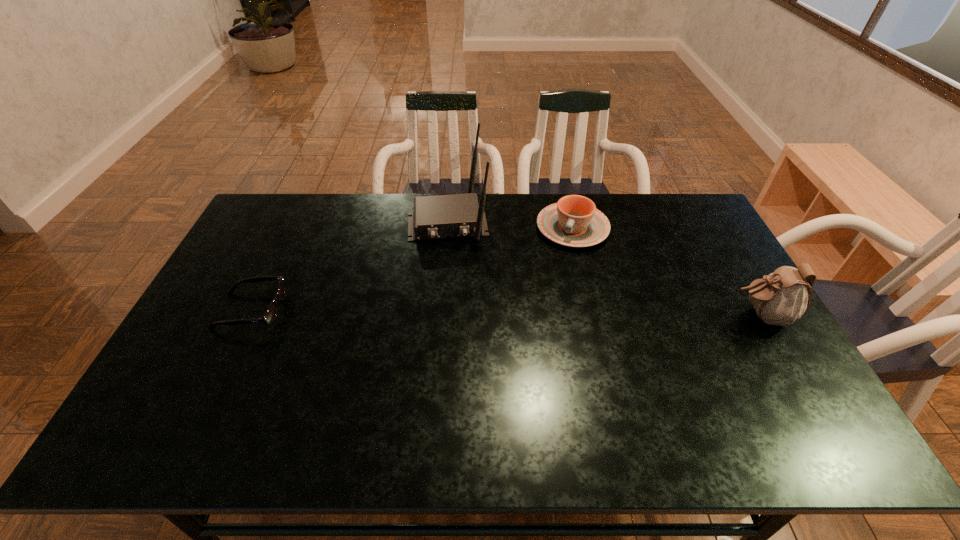
I want to click on object at the left edge, so click(269, 316).

At what (x,y) coordinates should I click in order to perform the action: click on object at the right edge. Please return your answer as a coordinate pair (x, y). The image size is (960, 540). Looking at the image, I should click on (780, 298).

You are a GUI agent. You are given a task and a screenshot of the screen. Output one action in this format:
    pyautogui.click(x=<x>, y=<y>)
    Task: Click on the free space at the far edge
    This screenshot has height=540, width=960.
    Given the screenshot: What is the action you would take?
    pyautogui.click(x=349, y=198)

In the image, there is a desktop. Identify the location of vacant space at the near edge. The width and height of the screenshot is (960, 540). (577, 382).

Find the location of a particular element. The width and height of the screenshot is (960, 540). vacant space at the far left corner of the desktop is located at coordinates (283, 210).

I want to click on blank space at the near left corner, so click(x=196, y=392).

Where is `unoccupied area between the shortest object and the chinaware`? This screenshot has width=960, height=540. unoccupied area between the shortest object and the chinaware is located at coordinates (412, 269).

This screenshot has width=960, height=540. What are the coordinates of `vacant space that is in between the second object from left to right and the pouch` in the screenshot? It's located at (604, 269).

Where is `vacant area that lies between the chinaware and the spectacles`? vacant area that lies between the chinaware and the spectacles is located at coordinates (412, 269).

Where is `free space between the rightmost object and the shortest object`? free space between the rightmost object and the shortest object is located at coordinates (506, 313).